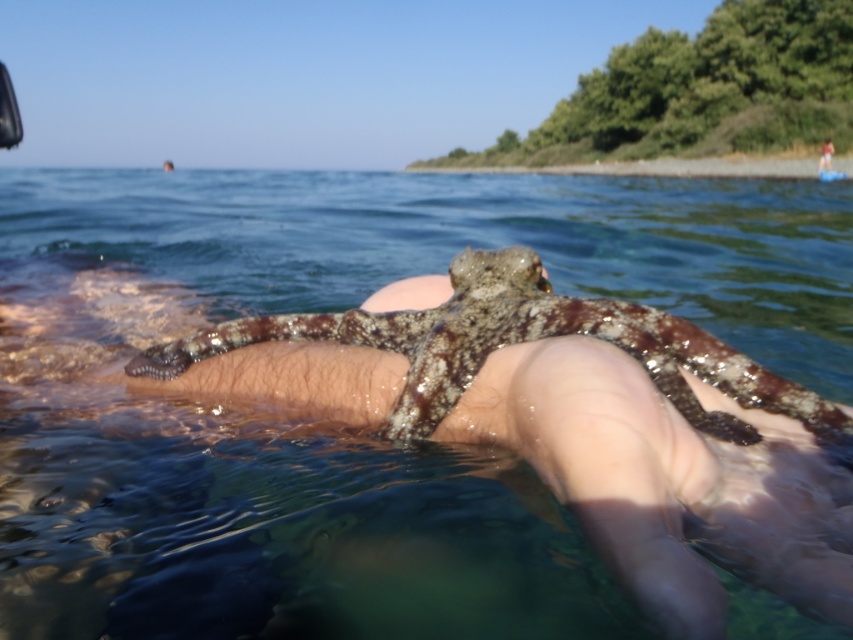
You are a marine biologist observing the speckled skin octopus at center and the smooth skin at upper center in the water. Which object takes up more area in the image?

The smooth skin at upper center takes up more area in the image than the speckled skin octopus at center.

You are a swimmer who wants to know if the clear water at legs upper is wider than the smooth skin at upper center. Can you confirm this based on the scene?

The clear water at legs upper is wider than the smooth skin at upper center according to the scene description.

You are a marine biologist observing the speckled skin octopus at center and the smooth skin at upper center in the water. Which of these two objects is shorter in height?

The speckled skin octopus at center is shorter in height compared to the smooth skin at upper center.